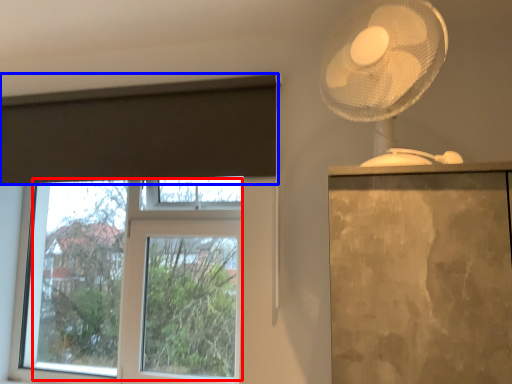
Question: Among these objects, which one is nearest to the camera, bay window (highlighted by a red box) or curtain (highlighted by a blue box)?

Choices:
 (A) bay window
 (B) curtain

Answer: (B)